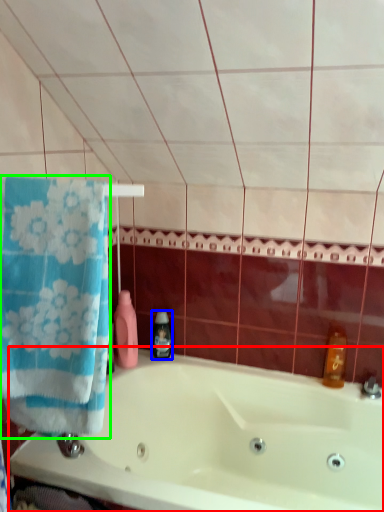
Question: Estimate the real-world distances between objects in this image. Which object is farther from bathtub (highlighted by a red box), soap dispenser (highlighted by a blue box) or towel (highlighted by a green box)?

Choices:
 (A) soap dispenser
 (B) towel

Answer: (B)